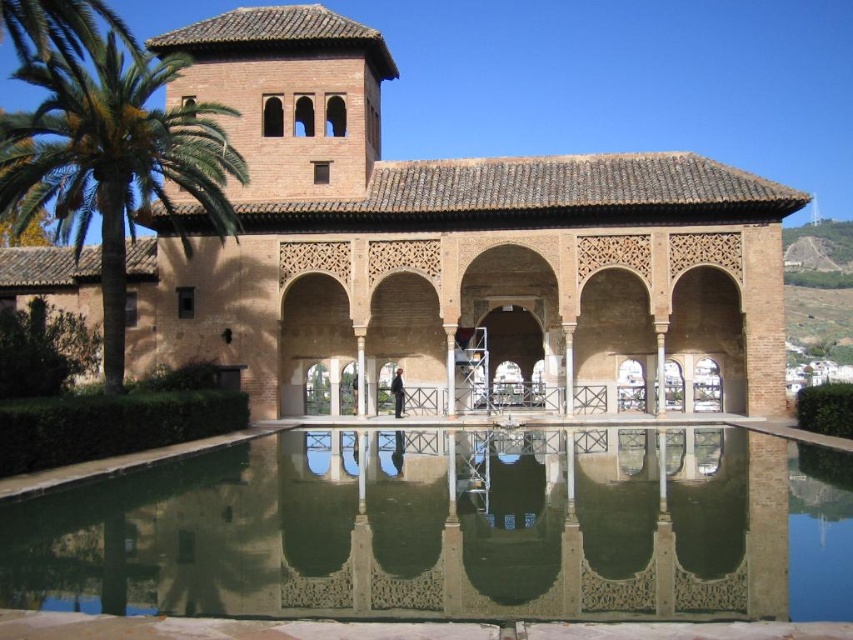
Question: Which of the following is the closest to the observer?

Choices:
 (A) (132, 147)
 (B) (315, 486)

Answer: (B)

Question: Which point is closer to the camera?

Choices:
 (A) green reflective water at center
 (B) green leafy palm tree at left

Answer: (A)

Question: In this image, where is brown textured palace at center located relative to green reflective water at center?

Choices:
 (A) left
 (B) right

Answer: (A)

Question: Which of the following is the closest to the observer?

Choices:
 (A) green reflective water at center
 (B) brown textured palace at center

Answer: (A)

Question: Does brown textured palace at center have a smaller size compared to green leafy palm tree at left?

Choices:
 (A) no
 (B) yes

Answer: (B)

Question: Where is brown textured palace at center located in relation to green reflective water at center in the image?

Choices:
 (A) right
 (B) left

Answer: (B)